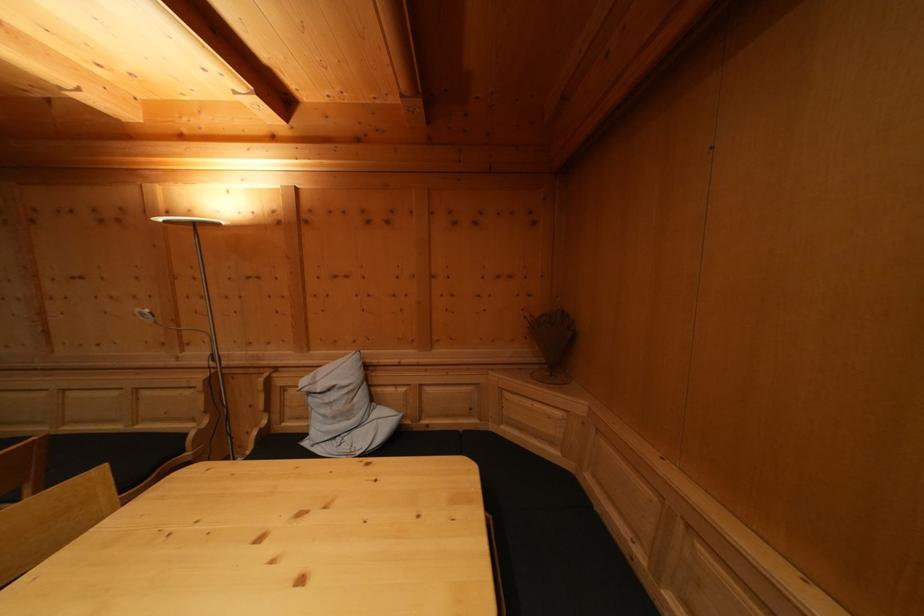
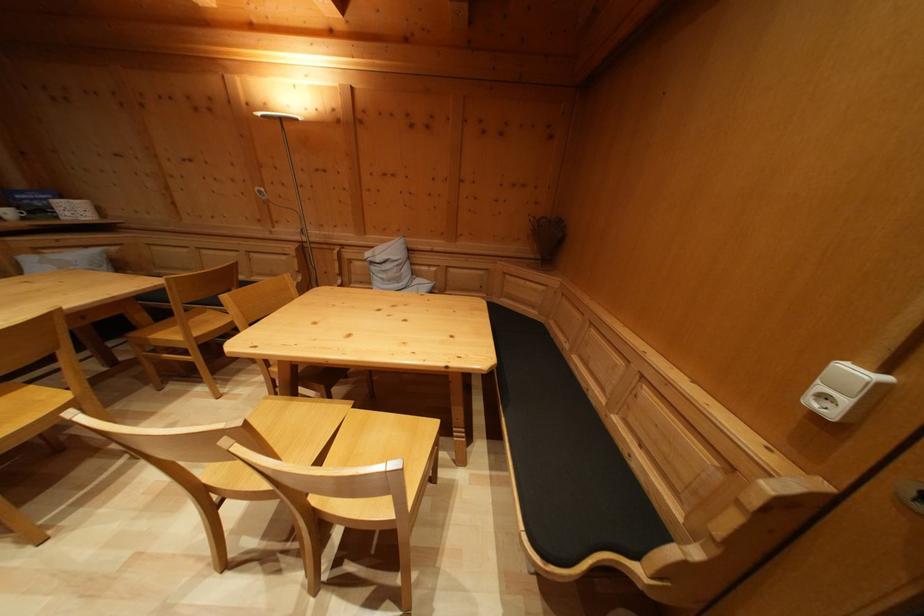
Question: In a continuous first-person perspective shot, in which direction is the camera moving?

Choices:
 (A) Left
 (B) Right
 (C) Forward
 (D) Backward

Answer: (D)